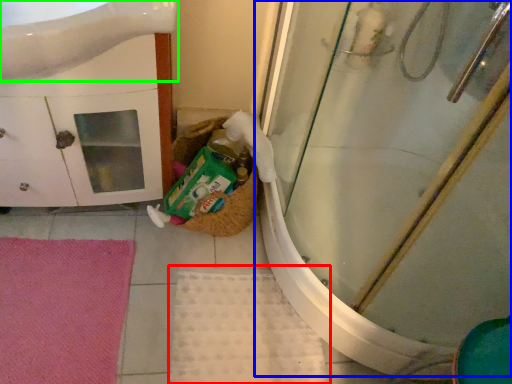
Question: Based on their relative distances, which object is nearer to bath mat (highlighted by a red box)? Choose from shower door (highlighted by a blue box) and sink (highlighted by a green box).

Choices:
 (A) shower door
 (B) sink

Answer: (A)